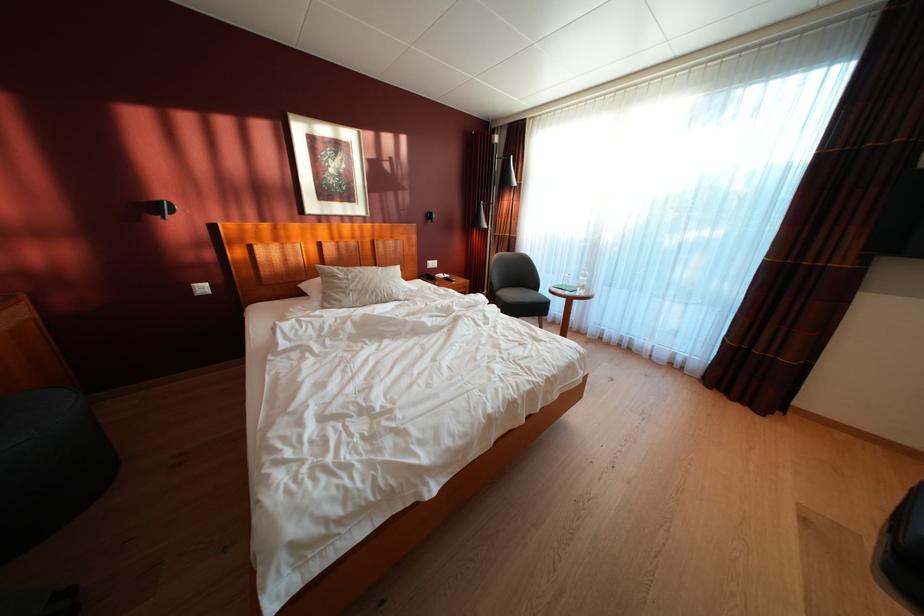
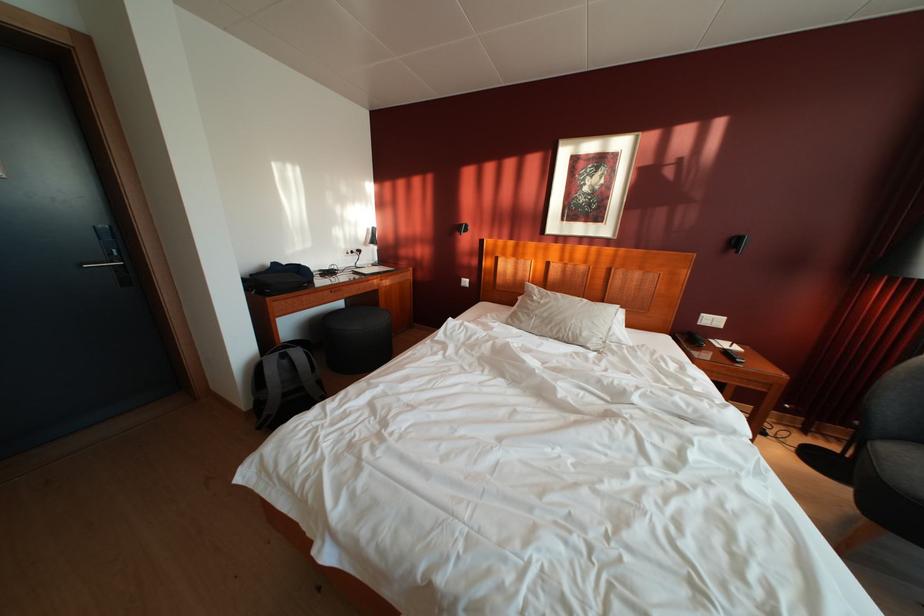
In the second image, find the point that corresponds to [403,297] in the first image.

(593, 339)